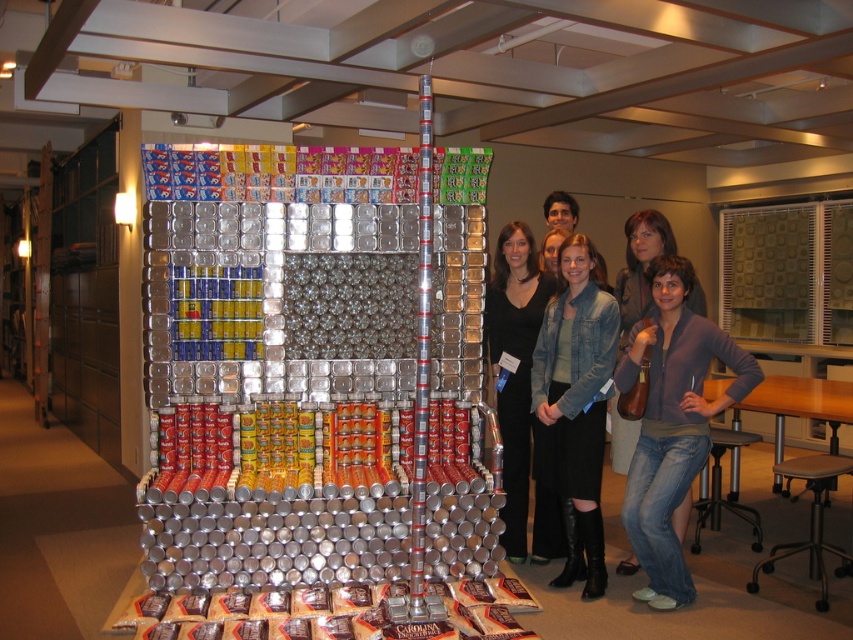
You are standing in front of the canned goods house structure. There are two points marked on the structure. The first point is at coordinate point [560,490] and the second point is at coordinate point [503,316]. Which point is closer to you?

Point [560,490] is closer to the camera than point [503,316].

You are a photographer setting up for a photoshoot. You need to position a tripod so that it doesn not block the view of both the black dress at center and the denim jeans at lower right. Given their positions, where should you place the tripod?

The black dress at center is located below denim jeans at lower right, so placing the tripod to the side of both objects would ensure neither is blocked.